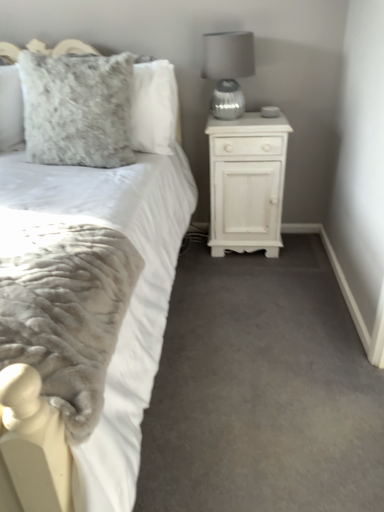
The height and width of the screenshot is (512, 384). Describe the element at coordinates (92, 301) in the screenshot. I see `white plush bed at center` at that location.

Describe the element at coordinates (228, 70) in the screenshot. This screenshot has width=384, height=512. I see `satin silver lamp at upper right` at that location.

Where is `white plush bed at center`? The width and height of the screenshot is (384, 512). white plush bed at center is located at coordinates (92, 301).

In the image, is white plush bed at center positioned in front of or behind satin silver lamp at upper right?

Visually, white plush bed at center is located in front of satin silver lamp at upper right.

Can you tell me how much white plush bed at center and satin silver lamp at upper right differ in facing direction?

There is a 2.38-degree angle between the facing directions of white plush bed at center and satin silver lamp at upper right.

Consider the image. Is white plush bed at center turned away from satin silver lamp at upper right?

white plush bed at center does not have its back to satin silver lamp at upper right.

From the image's perspective, does white plush bed at center appear higher than satin silver lamp at upper right?

No, from the image's perspective, white plush bed at center is not on top of satin silver lamp at upper right.

Which object is further away from the camera taking this photo, satin silver lamp at upper right or fuzzy gray pillow at upper left?

Positioned behind is satin silver lamp at upper right.

Is satin silver lamp at upper right at the left side of fuzzy gray pillow at upper left?

No, satin silver lamp at upper right is not to the left of fuzzy gray pillow at upper left.

Is point (214, 99) closer to viewer compared to point (56, 117)?

No, (214, 99) is behind (56, 117).

Is satin silver lamp at upper right not inside fuzzy gray pillow at upper left?

Absolutely, satin silver lamp at upper right is external to fuzzy gray pillow at upper left.

Based on the photo, could you tell me if satin silver lamp at upper right is facing white wood nightstand at right?

No, satin silver lamp at upper right is not oriented towards white wood nightstand at right.

Can you confirm if satin silver lamp at upper right is thinner than white wood nightstand at right?

Yes, satin silver lamp at upper right is thinner than white wood nightstand at right.

Would you say satin silver lamp at upper right is outside white wood nightstand at right?

satin silver lamp at upper right lies outside white wood nightstand at right's area.

Considering the relative sizes of satin silver lamp at upper right and white wood nightstand at right in the image provided, is satin silver lamp at upper right bigger than white wood nightstand at right?

No, satin silver lamp at upper right is not bigger than white wood nightstand at right.

Considering the sizes of objects fuzzy gray pillow at upper left and satin silver lamp at upper right in the image provided, who is taller, fuzzy gray pillow at upper left or satin silver lamp at upper right?

Standing taller between the two is fuzzy gray pillow at upper left.

Is fuzzy gray pillow at upper left outside of satin silver lamp at upper right?

Yes, fuzzy gray pillow at upper left is outside of satin silver lamp at upper right.

Which object is further away from the camera taking this photo, fuzzy gray pillow at upper left or satin silver lamp at upper right?

satin silver lamp at upper right is further from the camera.

What's the angular difference between fuzzy gray pillow at upper left and white wood nightstand at right's facing directions?

fuzzy gray pillow at upper left and white wood nightstand at right are facing 0.0854 degrees away from each other.

Is white wood nightstand at right surrounded by fuzzy gray pillow at upper left?

That's incorrect, white wood nightstand at right is not inside fuzzy gray pillow at upper left.

Is point (127, 132) closer to viewer compared to point (218, 211)?

That is True.

From a real-world perspective, is fuzzy gray pillow at upper left above or below white wood nightstand at right?

fuzzy gray pillow at upper left is above white wood nightstand at right.

Which of these two, white plush bed at center or fuzzy gray pillow at upper left, stands shorter?

Standing shorter between the two is fuzzy gray pillow at upper left.

Which object is thinner, white plush bed at center or fuzzy gray pillow at upper left?

With smaller width is fuzzy gray pillow at upper left.

In terms of size, does white plush bed at center appear bigger or smaller than fuzzy gray pillow at upper left?

Clearly, white plush bed at center is larger in size than fuzzy gray pillow at upper left.

How different are the orientations of white wood nightstand at right and satin silver lamp at upper right in degrees?

The facing directions of white wood nightstand at right and satin silver lamp at upper right are 0.0199 degrees apart.

From a real-world perspective, is white wood nightstand at right positioned above or below satin silver lamp at upper right?

Clearly, from a real-world perspective, white wood nightstand at right is below satin silver lamp at upper right.

Considering the positions of objects white wood nightstand at right and satin silver lamp at upper right in the image provided, who is behind, white wood nightstand at right or satin silver lamp at upper right?

white wood nightstand at right is further away from the camera.

Does white wood nightstand at right turn towards satin silver lamp at upper right?

No, white wood nightstand at right does not turn towards satin silver lamp at upper right.

Locate an element on the screen. bed in front of the satin silver lamp at upper right is located at coordinates (92, 301).

What are the coordinates of `lamp above the fuzzy gray pillow at upper left (from a real-world perspective)` in the screenshot? It's located at (228, 70).

Consider the image. From the image, which object appears to be nearer to fuzzy gray pillow at upper left, white plush bed at center or satin silver lamp at upper right?

white plush bed at center lies closer to fuzzy gray pillow at upper left than the other object.

Estimate the real-world distances between objects in this image. Which object is closer to fuzzy gray pillow at upper left, white wood nightstand at right or satin silver lamp at upper right?

satin silver lamp at upper right.

Estimate the real-world distances between objects in this image. Which object is closer to white plush bed at center, fuzzy gray pillow at upper left or satin silver lamp at upper right?

fuzzy gray pillow at upper left.

When comparing their distances from white wood nightstand at right, does satin silver lamp at upper right or fuzzy gray pillow at upper left seem further?

fuzzy gray pillow at upper left is positioned further to the anchor white wood nightstand at right.

Estimate the real-world distances between objects in this image. Which object is further from satin silver lamp at upper right, fuzzy gray pillow at upper left or white wood nightstand at right?

Among the two, fuzzy gray pillow at upper left is located further to satin silver lamp at upper right.

Based on their spatial positions, is white plush bed at center or satin silver lamp at upper right further from white wood nightstand at right?

The object further to white wood nightstand at right is white plush bed at center.

Looking at the image, which one is located closer to white wood nightstand at right, fuzzy gray pillow at upper left or white plush bed at center?

fuzzy gray pillow at upper left is positioned closer to the anchor white wood nightstand at right.

When comparing their distances from satin silver lamp at upper right, does white wood nightstand at right or white plush bed at center seem further?

white plush bed at center is further to satin silver lamp at upper right.

At what (x,y) coordinates should I click in order to perform the action: click on lamp between fuzzy gray pillow at upper left and white wood nightstand at right in the horizontal direction. Please return your answer as a coordinate pair (x, y). The height and width of the screenshot is (512, 384). Looking at the image, I should click on (228, 70).

Where is `lamp between white plush bed at center and white wood nightstand at right along the z-axis`? lamp between white plush bed at center and white wood nightstand at right along the z-axis is located at coordinates (228, 70).

I want to click on pillow between white plush bed at center and white wood nightstand at right along the z-axis, so click(x=77, y=109).

Locate an element on the screen. This screenshot has width=384, height=512. pillow positioned between white plush bed at center and satin silver lamp at upper right from near to far is located at coordinates (77, 109).